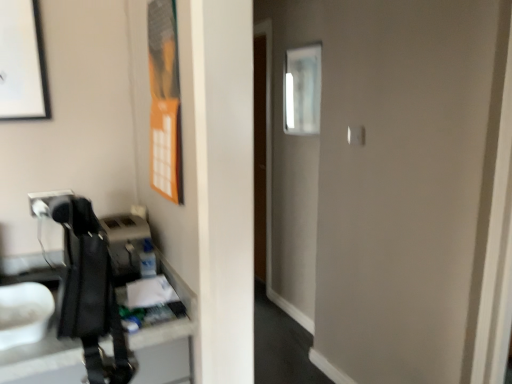
Where is `clear glass mirror at upper center`? Image resolution: width=512 pixels, height=384 pixels. clear glass mirror at upper center is located at coordinates (302, 90).

Describe the element at coordinates (302, 90) in the screenshot. I see `clear glass mirror at upper center` at that location.

In order to face matte black picture frame at upper left, should I rotate leftwards or rightwards?

To face it directly, rotate left by 28.600 degrees.

The height and width of the screenshot is (384, 512). I want to click on matte black picture frame at upper left, so click(22, 62).

This screenshot has width=512, height=384. What do you see at coordinates (22, 62) in the screenshot?
I see `matte black picture frame at upper left` at bounding box center [22, 62].

You are a GUI agent. You are given a task and a screenshot of the screen. Output one action in this format:
    pyautogui.click(x=<x>, y=<y>)
    Task: Click on the clear glass mirror at upper center
    This screenshot has width=512, height=384.
    Given the screenshot: What is the action you would take?
    pyautogui.click(x=302, y=90)

Between matte black picture frame at upper left and clear glass mirror at upper center, which one appears on the left side from the viewer's perspective?

Positioned to the left is matte black picture frame at upper left.

Which object is more forward, matte black picture frame at upper left or clear glass mirror at upper center?

matte black picture frame at upper left is in front.

Considering the points (44, 113) and (311, 80), which point is in front, point (44, 113) or point (311, 80)?

Point (44, 113)

From the image's perspective, does matte black picture frame at upper left appear lower than clear glass mirror at upper center?

Correct, matte black picture frame at upper left appears lower than clear glass mirror at upper center in the image.

From a real-world perspective, which object rests below the other?

clear glass mirror at upper center is physically lower.

Which of these two, matte black picture frame at upper left or clear glass mirror at upper center, is wider?

Wider between the two is clear glass mirror at upper center.

Does matte black picture frame at upper left have a greater height compared to clear glass mirror at upper center?

No.

Is matte black picture frame at upper left smaller than clear glass mirror at upper center?

Indeed, matte black picture frame at upper left has a smaller size compared to clear glass mirror at upper center.

Looking at this image, is matte black picture frame at upper left completely or partially outside of clear glass mirror at upper center?

Yes, matte black picture frame at upper left is outside of clear glass mirror at upper center.

Would you consider matte black picture frame at upper left to be distant from clear glass mirror at upper center?

That's right, there is a large distance between matte black picture frame at upper left and clear glass mirror at upper center.

Is matte black picture frame at upper left facing away from clear glass mirror at upper center?

No, matte black picture frame at upper left is not facing away from clear glass mirror at upper center.

Locate an element on the screen. This screenshot has width=512, height=384. mirror that appears below the matte black picture frame at upper left (from a real-world perspective) is located at coordinates (302, 90).

Which is more to the right, clear glass mirror at upper center or matte black picture frame at upper left?

clear glass mirror at upper center.

Considering their positions, is clear glass mirror at upper center located in front of or behind matte black picture frame at upper left?

Clearly, clear glass mirror at upper center is behind matte black picture frame at upper left.

Does point (298, 67) come behind point (39, 39)?

That is True.

From the image's perspective, is clear glass mirror at upper center above matte black picture frame at upper left?

Correct, clear glass mirror at upper center appears higher than matte black picture frame at upper left in the image.

From a real-world perspective, which object stands above the other?

matte black picture frame at upper left, from a real-world perspective.

Considering the sizes of objects clear glass mirror at upper center and matte black picture frame at upper left in the image provided, who is thinner, clear glass mirror at upper center or matte black picture frame at upper left?

Thinner between the two is matte black picture frame at upper left.

Considering the relative sizes of clear glass mirror at upper center and matte black picture frame at upper left in the image provided, is clear glass mirror at upper center shorter than matte black picture frame at upper left?

Incorrect, the height of clear glass mirror at upper center does not fall short of that of matte black picture frame at upper left.

Which of these two, clear glass mirror at upper center or matte black picture frame at upper left, is smaller?

Smaller between the two is matte black picture frame at upper left.

Is clear glass mirror at upper center inside the boundaries of matte black picture frame at upper left, or outside?

clear glass mirror at upper center is spatially situated outside matte black picture frame at upper left.

Are clear glass mirror at upper center and matte black picture frame at upper left located far from each other?

Yes, clear glass mirror at upper center and matte black picture frame at upper left are located far from each other.

Is clear glass mirror at upper center oriented away from matte black picture frame at upper left?

That's not correct — clear glass mirror at upper center is not looking away from matte black picture frame at upper left.

From the picture: How many degrees apart are the facing directions of clear glass mirror at upper center and matte black picture frame at upper left?

They differ by 89 degrees in their facing directions.

Consider the image. How much distance is there between clear glass mirror at upper center and matte black picture frame at upper left?

They are 4.91 feet apart.

In the image, there is a matte black picture frame at upper left. At what (x,y) coordinates should I click in order to perform the action: click on mirror above it (from the image's perspective). Please return your answer as a coordinate pair (x, y). The image size is (512, 384). Looking at the image, I should click on (302, 90).

Find the location of `picture frame that appears below the clear glass mirror at upper center (from the image's perspective)`. picture frame that appears below the clear glass mirror at upper center (from the image's perspective) is located at coordinates (22, 62).

In order to click on mirror above the matte black picture frame at upper left (from the image's perspective) in this screenshot , I will do `click(302, 90)`.